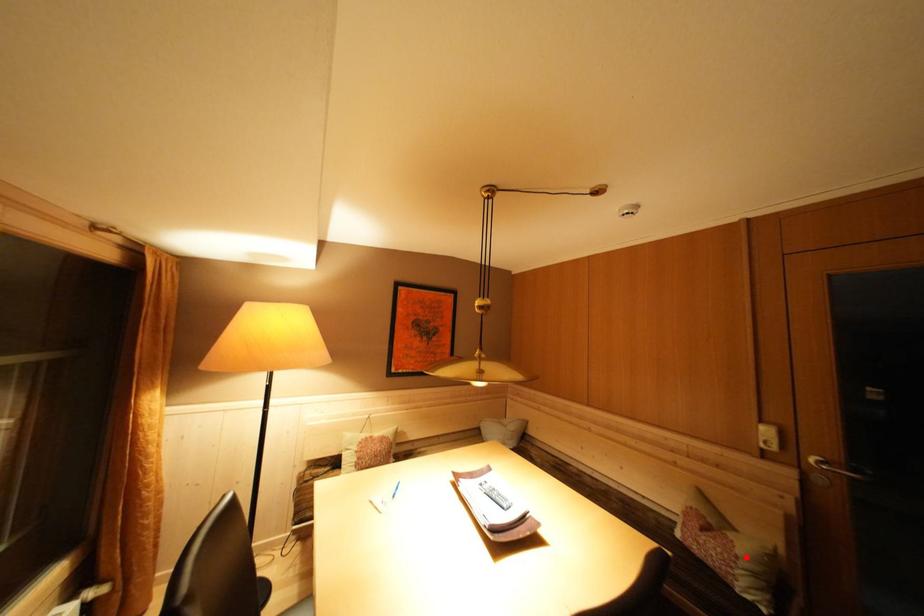
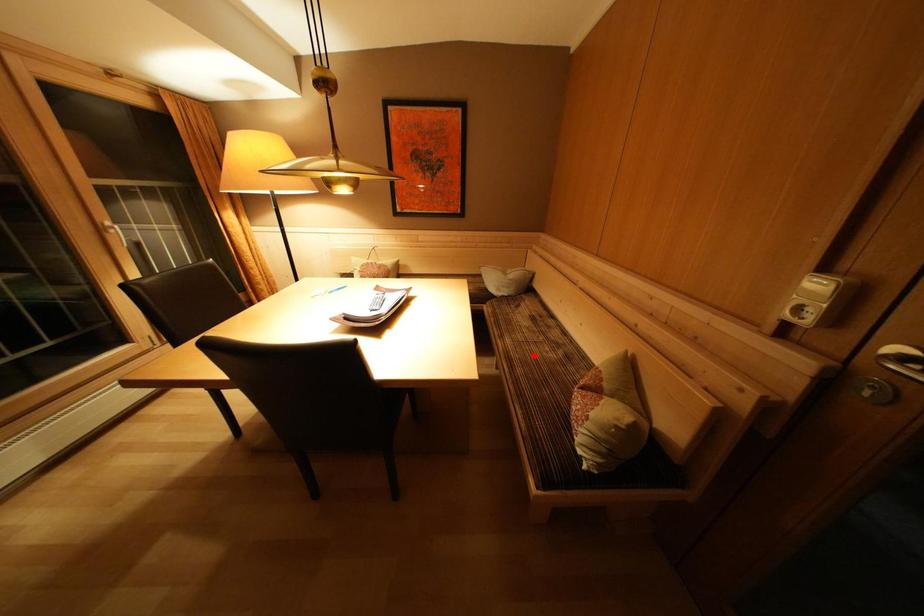
I am providing you with two images of the same scene from different viewpoints. A red point is marked on the first image and another point is marked on the second image. Is the red point in image1 aligned with the point shown in image2?

No